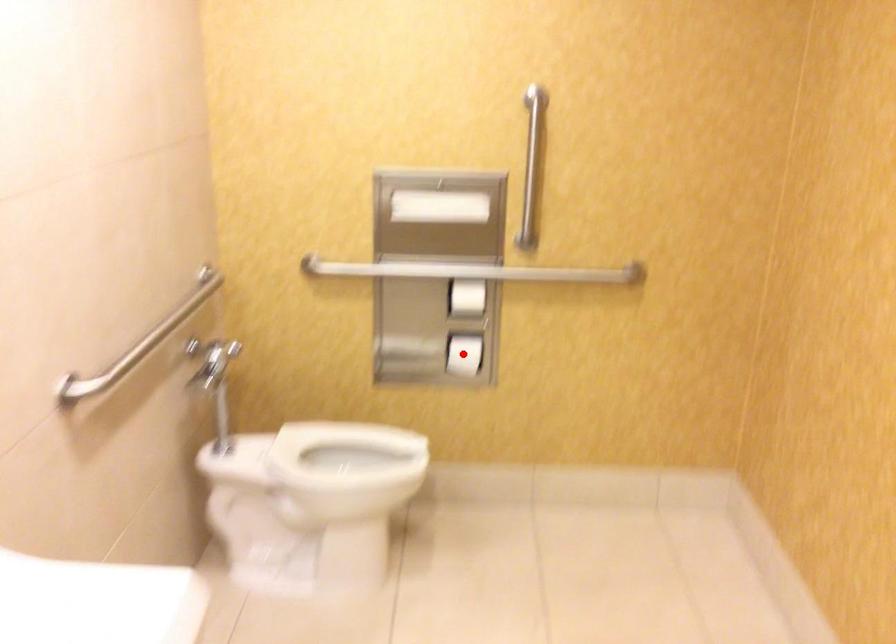
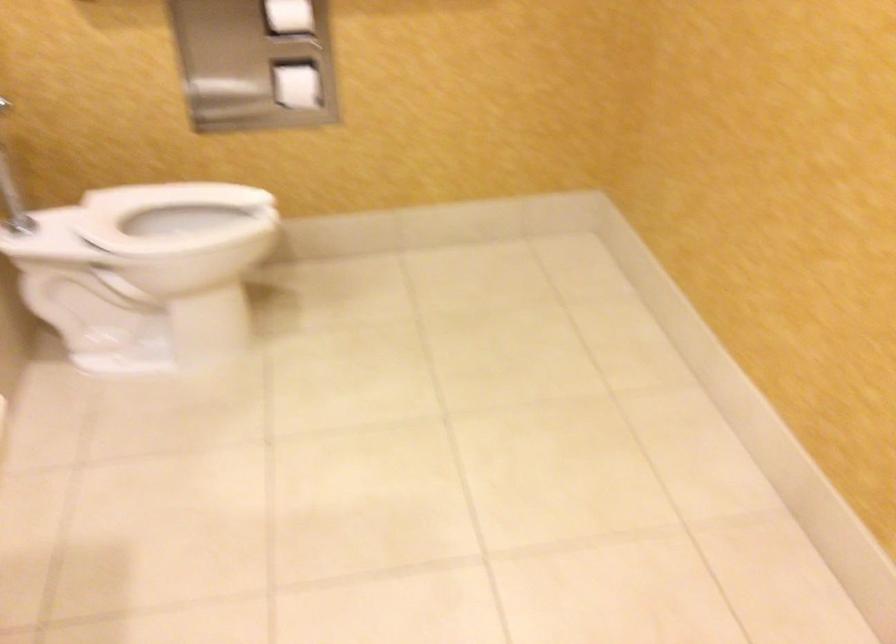
Question: I am providing you with two images of the same scene from different viewpoints. In image1, a red point is highlighted. Considering the same 3D point in image2, which of the following is correct?

Choices:
 (A) It is closer
 (B) It is farther

Answer: (A)